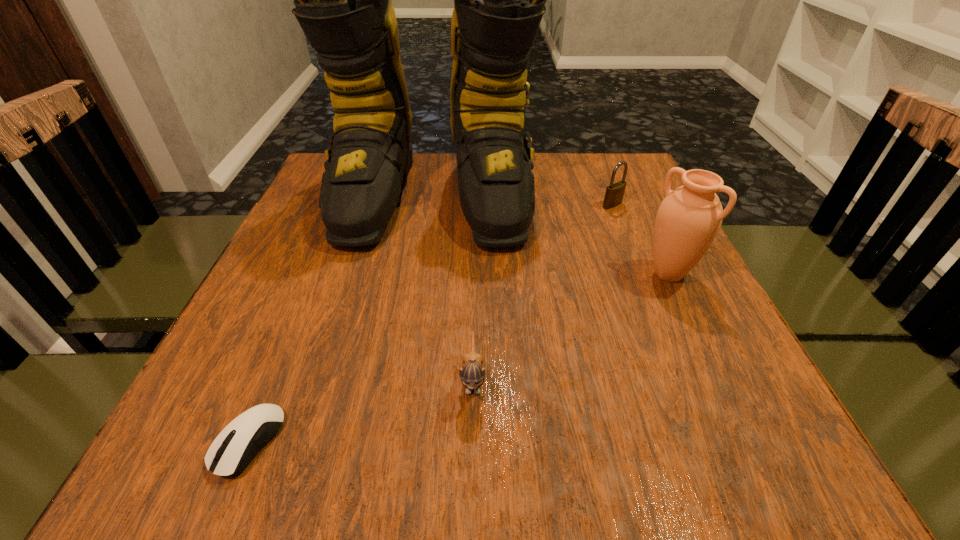
Locate an element on the screen. This screenshot has width=960, height=540. free space at the left edge of the desktop is located at coordinates (313, 284).

In the image, there is a desktop. Where is `free space at the right edge`? free space at the right edge is located at coordinates (661, 369).

Where is `free space at the far left corner of the desktop`? Image resolution: width=960 pixels, height=540 pixels. free space at the far left corner of the desktop is located at coordinates (316, 174).

Locate an element on the screen. Image resolution: width=960 pixels, height=540 pixels. free region at the near right corner of the desktop is located at coordinates (777, 458).

Where is `free space between the padlock and the third farthest object`? This screenshot has height=540, width=960. free space between the padlock and the third farthest object is located at coordinates (640, 239).

Image resolution: width=960 pixels, height=540 pixels. Identify the location of free space between the tallest object and the mouse. (340, 319).

Image resolution: width=960 pixels, height=540 pixels. Find the location of `free area in between the third nearest object and the ski boots`. free area in between the third nearest object and the ski boots is located at coordinates (550, 235).

The width and height of the screenshot is (960, 540). I want to click on vacant space that is in between the third farthest object and the tallest object, so click(x=550, y=235).

The width and height of the screenshot is (960, 540). I want to click on free space between the shortest object and the ski boots, so click(340, 319).

Locate an element on the screen. free point between the mouse and the tallest object is located at coordinates (340, 319).